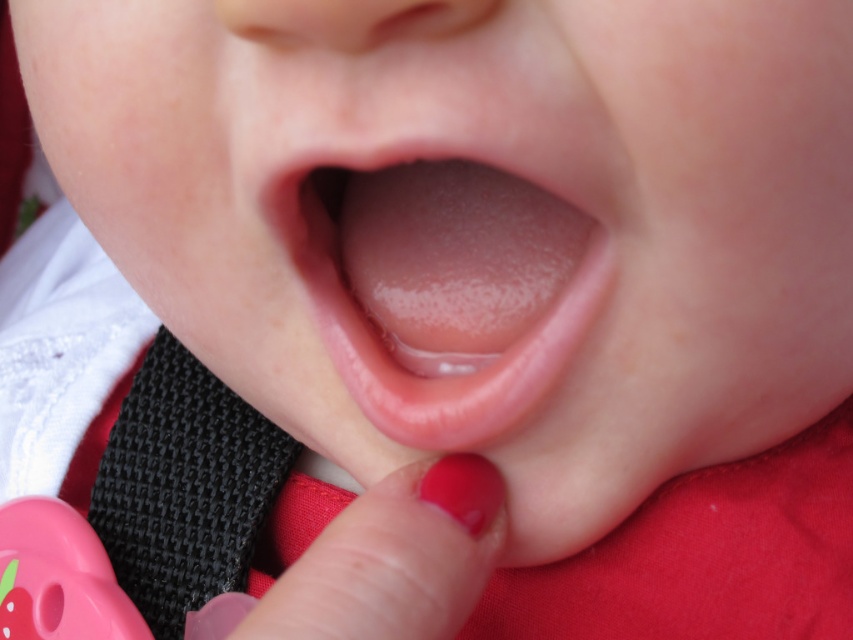
Which is above, smooth pink tongue at center or black woven strap at lower left?

smooth pink tongue at center is higher up.

Can you confirm if smooth pink tongue at center is positioned below black woven strap at lower left?

No.

Is point (440, 257) positioned after point (109, 518)?

That is False.

You are a GUI agent. You are given a task and a screenshot of the screen. Output one action in this format:
    pyautogui.click(x=<x>, y=<y>)
    Task: Click on the smooth pink tongue at center
    The height and width of the screenshot is (640, 853).
    Given the screenshot: What is the action you would take?
    pyautogui.click(x=440, y=284)

What are the coordinates of `smooth pink tongue at center` in the screenshot? It's located at (440, 284).

Is point (465, 340) closer to camera compared to point (462, 470)?

No, it is not.

Is point (347, 353) farther from viewer compared to point (466, 524)?

Yes, point (347, 353) is behind point (466, 524).

Identify the location of smooth pink tongue at center. (440, 284).

Is point (125, 515) positioned before point (462, 458)?

No, it is not.

Is black woven strap at lower left smaller than glossy plastic teething ring at lower center?

No.

Where is `black woven strap at lower left`? Image resolution: width=853 pixels, height=640 pixels. black woven strap at lower left is located at coordinates (178, 483).